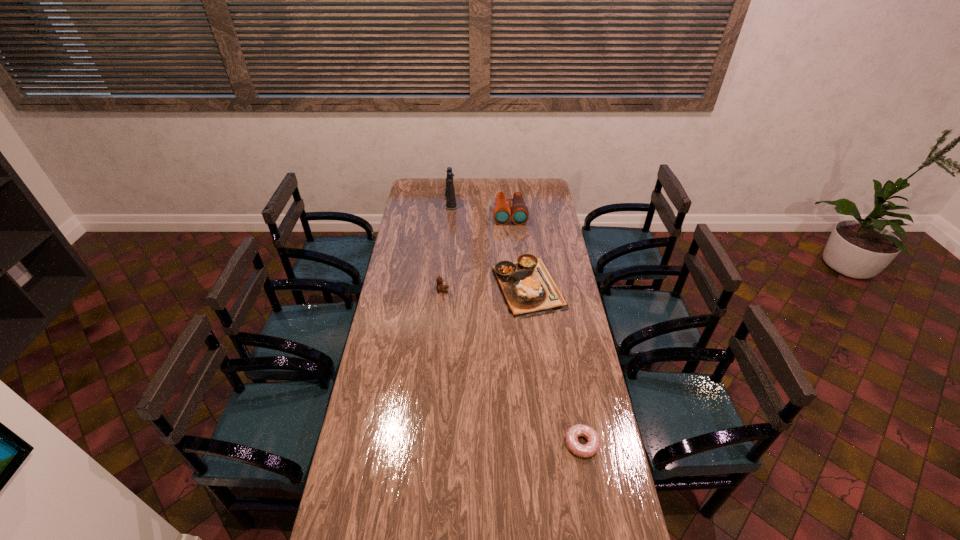
Identify the location of the left binoculars. (450, 190).

Locate an element on the screen. the taller binoculars is located at coordinates (450, 190).

Find the location of a particular element. Image resolution: width=960 pixels, height=540 pixels. the right binoculars is located at coordinates (502, 213).

Find the location of a particular element. This screenshot has width=960, height=540. the second tallest object is located at coordinates (502, 213).

Locate an element on the screen. teddy bear is located at coordinates (440, 287).

At what (x,y) coordinates should I click in order to perform the action: click on the fourth tallest object. Please return your answer as a coordinate pair (x, y). Image resolution: width=960 pixels, height=540 pixels. Looking at the image, I should click on (528, 289).

Locate an element on the screen. doughnut is located at coordinates (579, 430).

Where is `the nearest object`? The width and height of the screenshot is (960, 540). the nearest object is located at coordinates (579, 430).

At what (x,y) coordinates should I click in order to perform the action: click on free space located 0.140m on the front of the taller binoculars. Please return your answer as a coordinate pair (x, y). This screenshot has width=960, height=540. Looking at the image, I should click on (448, 225).

What are the coordinates of `vacant point located 0.080m through the lenses of the shorter binoculars` in the screenshot? It's located at (512, 234).